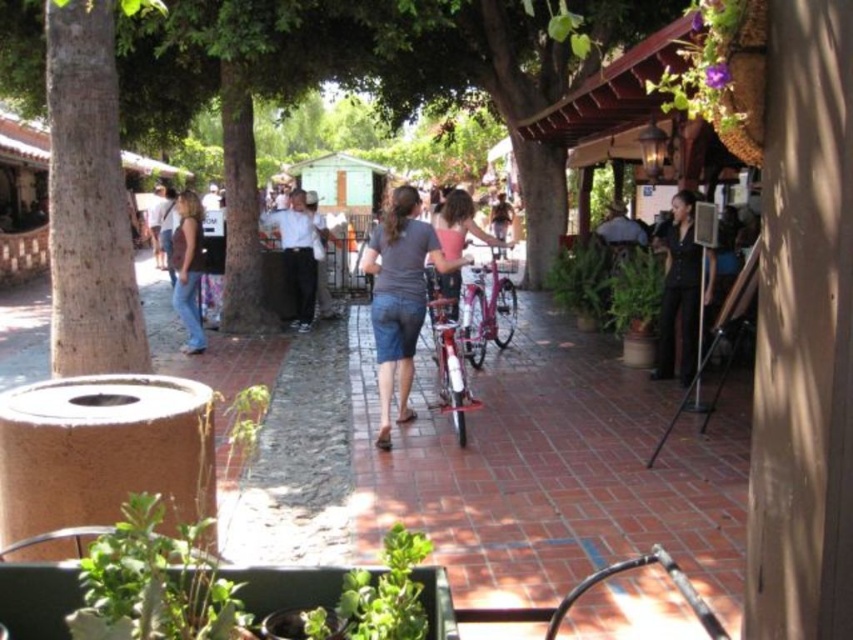
Can you confirm if white shirt at center is bigger than green leafy plant at right?

Correct, white shirt at center is larger in size than green leafy plant at right.

Which is behind, point (303, 296) or point (613, 300)?

Positioned behind is point (303, 296).

At what (x,y) coordinates should I click in order to perform the action: click on white shirt at center. Please return your answer as a coordinate pair (x, y). This screenshot has height=640, width=853. Looking at the image, I should click on (296, 257).

Can you confirm if black leather dress at right is shorter than green leafy plant at center?

No, black leather dress at right is not shorter than green leafy plant at center.

Between black leather dress at right and green leafy plant at center, which one appears on the right side from the viewer's perspective?

black leather dress at right is more to the right.

The height and width of the screenshot is (640, 853). In order to click on black leather dress at right in this screenshot , I will do `click(679, 292)`.

Which is behind, point (706, 262) or point (296, 259)?

Point (296, 259)

Between point (666, 323) and point (282, 234), which one is positioned in front?

Positioned in front is point (666, 323).

Describe the element at coordinates (679, 292) in the screenshot. I see `black leather dress at right` at that location.

The width and height of the screenshot is (853, 640). In order to click on black leather dress at right in this screenshot , I will do click(679, 292).